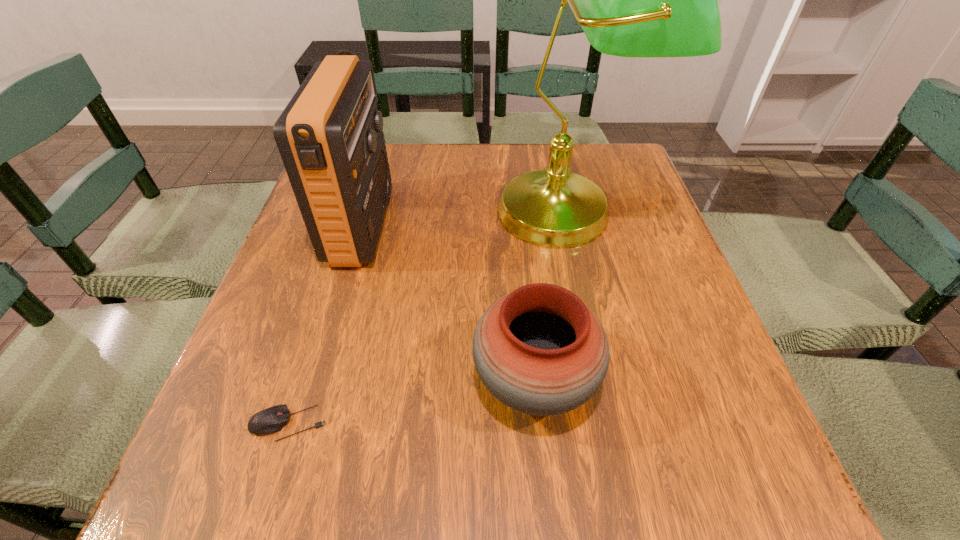
You are a GUI agent. You are given a task and a screenshot of the screen. Output one action in this format:
    pyautogui.click(x=<x>, y=<y>)
    Task: Click on the radio receiver that is at the left edge
    
    Given the screenshot: What is the action you would take?
    pyautogui.click(x=330, y=136)

Identify the location of mouse positioned at the left edge. (271, 420).

Where is `object present at the right edge`? Image resolution: width=960 pixels, height=540 pixels. object present at the right edge is located at coordinates (632, 0).

The height and width of the screenshot is (540, 960). I want to click on object that is at the far left corner, so click(x=330, y=136).

I want to click on object at the far right corner, so click(x=632, y=0).

Where is `vacant space at the far edge`? vacant space at the far edge is located at coordinates (468, 148).

In the image, there is a desktop. Where is `vacant space at the near edge`? This screenshot has width=960, height=540. vacant space at the near edge is located at coordinates (401, 497).

This screenshot has width=960, height=540. In the image, there is a desktop. Identify the location of blank space at the left edge. (235, 390).

Image resolution: width=960 pixels, height=540 pixels. In the image, there is a desktop. Find the location of `vacant space at the right edge`. vacant space at the right edge is located at coordinates (644, 295).

Identify the location of vacant area at the far right corner of the desktop. The image size is (960, 540). click(x=642, y=180).